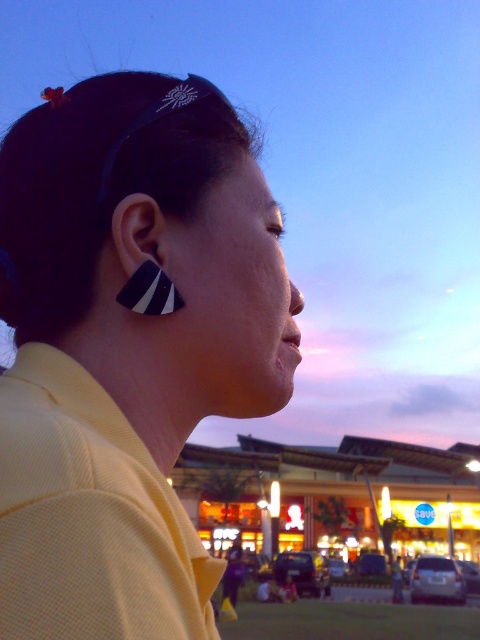
You are a GUI agent. You are given a task and a screenshot of the screen. Output one action in this format:
    pyautogui.click(x=<x>, y=<y>)
    Task: Click on the matte yellow shirt at center
    
    Given the screenshot: What is the action you would take?
    pyautogui.click(x=128, y=349)

Does matte yellow shirt at center appear on the right side of black matte/striped earring at left?

Correct, you'll find matte yellow shirt at center to the right of black matte/striped earring at left.

Locate an element on the screen. This screenshot has height=640, width=480. matte yellow shirt at center is located at coordinates (128, 349).

Locate an element on the screen. matte yellow shirt at center is located at coordinates (128, 349).